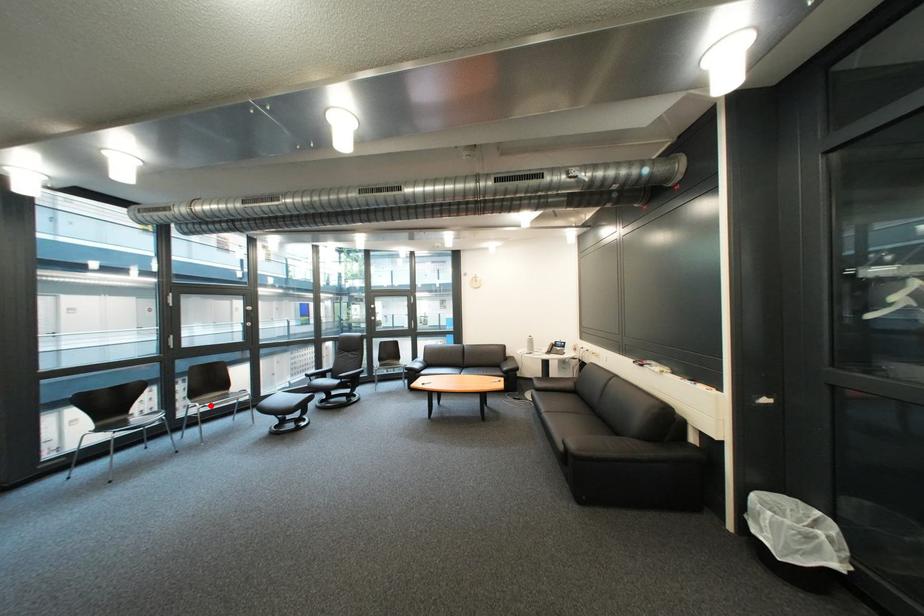
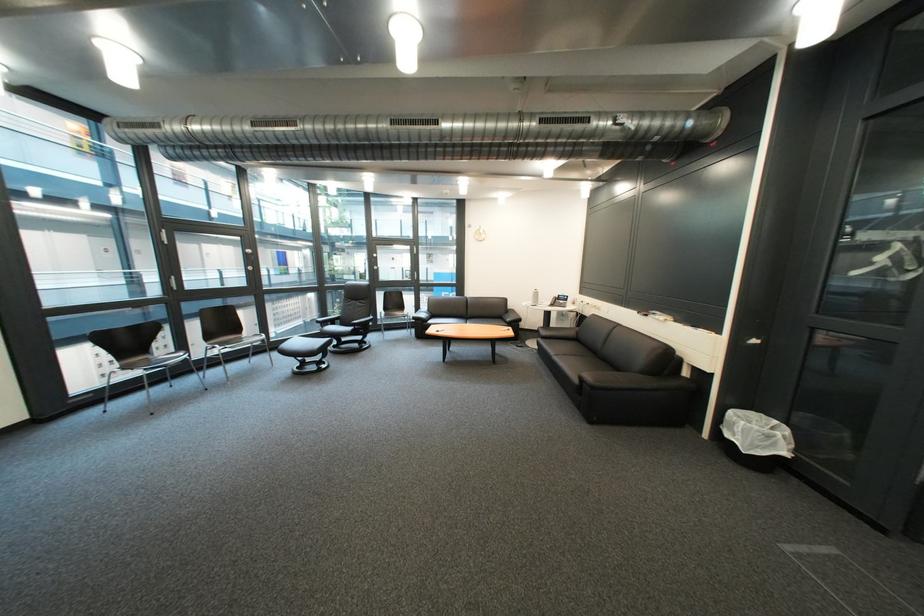
Question: I am providing you with two images of the same scene from different viewpoints. In image1, a red point is highlighted. Considering the same 3D point in image2, which of the following is correct?

Choices:
 (A) It is closer
 (B) It is farther

Answer: (A)